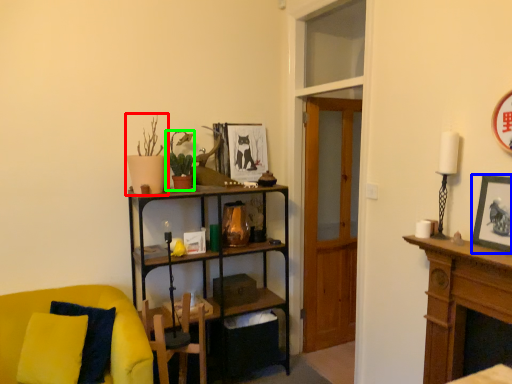
Question: Which is farther away from houseplant (highlighted by a red box)? picture frame (highlighted by a blue box) or houseplant (highlighted by a green box)?

Choices:
 (A) picture frame
 (B) houseplant

Answer: (A)